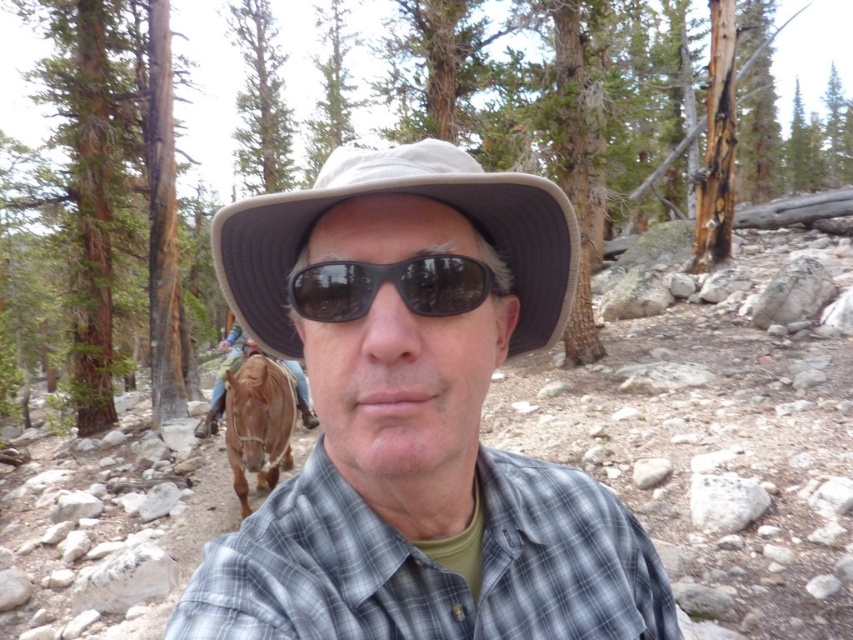
Who is shorter, gray checkered shirt at center or brown bark tree at left?

gray checkered shirt at center

Does gray checkered shirt at center have a greater height compared to brown bark tree at left?

No, gray checkered shirt at center is not taller than brown bark tree at left.

Is point (218, 547) positioned before point (96, 371)?

Yes, point (218, 547) is in front of point (96, 371).

I want to click on gray checkered shirt at center, so click(x=431, y=566).

What are the coordinates of `beige fabric hat at center` in the screenshot? It's located at (410, 193).

Is beige fabric hat at center taller than brown bark tree at center?

No, beige fabric hat at center is not taller than brown bark tree at center.

Is point (360, 179) positioned in front of point (6, 44)?

Yes, point (360, 179) is closer to viewer.

In order to click on beige fabric hat at center in this screenshot , I will do `click(410, 193)`.

Does point (170, 298) come in front of point (363, 177)?

That is False.

Find the location of `brown bark tree at left`. brown bark tree at left is located at coordinates (115, 182).

In order to click on brown bark tree at left in this screenshot , I will do `click(115, 182)`.